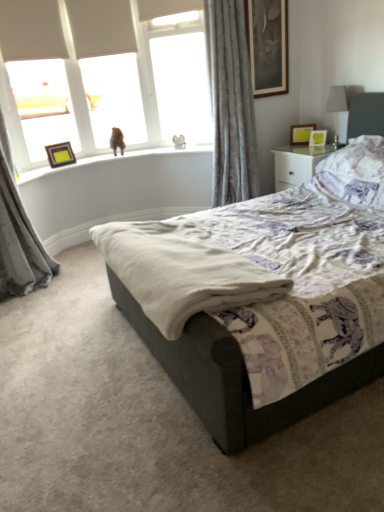
Locate an element on the screen. This screenshot has width=384, height=512. white glossy nightstand at upper right is located at coordinates [x=298, y=163].

Describe the element at coordinates (43, 105) in the screenshot. I see `matte white frame at upper left` at that location.

Locate an element on the screen. The image size is (384, 512). matte yellow picture frame at upper right, marked as the first picture frame in a right-to-left arrangement is located at coordinates (318, 138).

Describe the element at coordinates (318, 138) in the screenshot. I see `matte yellow picture frame at upper right, marked as the first picture frame in a right-to-left arrangement` at that location.

Locate an element on the screen. white glossy nightstand at upper right is located at coordinates (298, 163).

Is matte black picture frame at upper left, the 4th picture frame in the right-to-left sequence, thinner than matte yellow picture frame at upper right, marked as the first picture frame in a right-to-left arrangement?

Incorrect, the width of matte black picture frame at upper left, the 4th picture frame in the right-to-left sequence, is not less than that of matte yellow picture frame at upper right, marked as the first picture frame in a right-to-left arrangement.

From the image's perspective, which one is positioned lower, matte black picture frame at upper left, placed as the 4th picture frame when sorted from top to bottom, or matte yellow picture frame at upper right, the 4th picture frame from the left?

From the image's view, matte black picture frame at upper left, placed as the 4th picture frame when sorted from top to bottom, is below.

Based on the photo, which is farther from the camera, [49,158] or [312,145]?

The point [49,158] is farther from the camera.

In the scene shown: Which object is further away from the camera, gray velvet curtain at upper right, arranged as the 1th curtain when viewed from the right, or matte black picture frame at upper left, the 4th picture frame in the right-to-left sequence?

matte black picture frame at upper left, the 4th picture frame in the right-to-left sequence, is more distant.

Does gray velvet curtain at upper right, which ranks as the second curtain in left-to-right order, contain matte black picture frame at upper left, the 4th picture frame in the right-to-left sequence?

No, matte black picture frame at upper left, the 4th picture frame in the right-to-left sequence, is not surrounded by gray velvet curtain at upper right, which ranks as the second curtain in left-to-right order.

Between gray velvet curtain at upper right, which ranks as the second curtain in left-to-right order, and matte black picture frame at upper left, placed as the 4th picture frame when sorted from top to bottom, which one has more height?

With more height is gray velvet curtain at upper right, which ranks as the second curtain in left-to-right order.

Considering the relative sizes of gray velvet curtain at upper right, arranged as the 1th curtain when viewed from the right, and matte black picture frame at upper left, the 4th picture frame in the right-to-left sequence, in the image provided, is gray velvet curtain at upper right, arranged as the 1th curtain when viewed from the right, thinner than matte black picture frame at upper left, the 4th picture frame in the right-to-left sequence,?

Incorrect, the width of gray velvet curtain at upper right, arranged as the 1th curtain when viewed from the right, is not less than that of matte black picture frame at upper left, the 4th picture frame in the right-to-left sequence.

From the image's perspective, would you say wooden-framed picture at upper right, which is the second picture frame from left to right, is shown under white plastic window screen at upper center?

Actually, wooden-framed picture at upper right, which is the second picture frame from left to right, appears above white plastic window screen at upper center in the image.

At what (x,y) coordinates should I click in order to perform the action: click on picture frame in front of the white plastic window screen at upper center. Please return your answer as a coordinate pair (x, y). The width and height of the screenshot is (384, 512). Looking at the image, I should click on (267, 45).

Does wooden-framed picture at upper right, which is the second picture frame from left to right, come in front of white plastic window screen at upper center?

Yes, it is.

In terms of height, does wooden-framed picture at upper right, which is the second picture frame from left to right, look taller or shorter compared to white plastic window screen at upper center?

In the image, wooden-framed picture at upper right, which is the second picture frame from left to right, appears to be shorter than white plastic window screen at upper center.

How distant is matte yellow picture frame at upper right, arranged as the third picture frame when viewed from the left, from beige cotton blanket at center?

matte yellow picture frame at upper right, arranged as the third picture frame when viewed from the left, and beige cotton blanket at center are 2.08 meters apart from each other.

Is matte yellow picture frame at upper right, positioned as the 2th picture frame in top-to-bottom order, facing away from beige cotton blanket at center?

No, matte yellow picture frame at upper right, positioned as the 2th picture frame in top-to-bottom order,'s orientation is not away from beige cotton blanket at center.

Would you consider matte yellow picture frame at upper right, the third picture frame in the bottom-to-top sequence, to be distant from beige cotton blanket at center?

Yes, matte yellow picture frame at upper right, the third picture frame in the bottom-to-top sequence, and beige cotton blanket at center are located far from each other.

Between matte yellow picture frame at upper right, arranged as the third picture frame when viewed from the left, and beige cotton blanket at center, which one has larger width?

beige cotton blanket at center.

Which is more to the right, wooden-framed picture at upper right, which is the second picture frame from left to right, or beige cotton blanket at center?

wooden-framed picture at upper right, which is the second picture frame from left to right.

Can you confirm if wooden-framed picture at upper right, marked as the 4th picture frame in a bottom-to-top arrangement, is smaller than beige cotton blanket at center?

Indeed, wooden-framed picture at upper right, marked as the 4th picture frame in a bottom-to-top arrangement, has a smaller size compared to beige cotton blanket at center.

From the image's perspective, is wooden-framed picture at upper right, positioned as the 1th picture frame in top-to-bottom order, located above or below beige cotton blanket at center?

From the image's perspective, wooden-framed picture at upper right, positioned as the 1th picture frame in top-to-bottom order, appears above beige cotton blanket at center.

Based on the photo, from a real-world perspective, which is physically below, wooden-framed picture at upper right, marked as the 4th picture frame in a bottom-to-top arrangement, or beige cotton blanket at center?

In real-world perspective, beige cotton blanket at center is lower.

In the scene shown: Is matte yellow picture frame at upper right, marked as the first picture frame in a right-to-left arrangement, located outside wooden-framed picture at upper right, marked as the 4th picture frame in a bottom-to-top arrangement?

That's correct, matte yellow picture frame at upper right, marked as the first picture frame in a right-to-left arrangement, is outside of wooden-framed picture at upper right, marked as the 4th picture frame in a bottom-to-top arrangement.

Is matte yellow picture frame at upper right, marked as the first picture frame in a right-to-left arrangement, bigger or smaller than wooden-framed picture at upper right, positioned as the 1th picture frame in top-to-bottom order?

Clearly, matte yellow picture frame at upper right, marked as the first picture frame in a right-to-left arrangement, is smaller in size than wooden-framed picture at upper right, positioned as the 1th picture frame in top-to-bottom order.

Is the surface of matte yellow picture frame at upper right, arranged as the second picture frame when ordered from the bottom, in direct contact with wooden-framed picture at upper right, positioned as the 1th picture frame in top-to-bottom order?

No, matte yellow picture frame at upper right, arranged as the second picture frame when ordered from the bottom, is not beside wooden-framed picture at upper right, positioned as the 1th picture frame in top-to-bottom order.

From the image's perspective, is velvet gray curtain at left, the 2th curtain from the right, over velvet grey bed at center?

Yes.

Would you say velvet grey bed at center is part of velvet gray curtain at left, the 2th curtain from the right,'s contents?

No, velvet grey bed at center is not inside velvet gray curtain at left, the 2th curtain from the right.

From a real-world perspective, relative to velvet grey bed at center, is velvet gray curtain at left, the 2th curtain from the right, vertically above or below?

velvet gray curtain at left, the 2th curtain from the right, is situated higher than velvet grey bed at center in the real world.

Who is more distant, velvet gray curtain at left, the 2th curtain from the right, or velvet grey bed at center?

velvet gray curtain at left, the 2th curtain from the right, is more distant.

Locate an element on the screen. This screenshot has height=512, width=384. the 1st picture frame behind the matte yellow picture frame at upper right, arranged as the second picture frame when ordered from the bottom, counting from the anchor's position is located at coordinates (60, 154).

You are a GUI agent. You are given a task and a screenshot of the screen. Output one action in this format:
    pyautogui.click(x=<x>, y=<y>)
    Task: Click on the 1st picture frame positioned below the gray velvet curtain at upper right, which ranks as the second curtain in left-to-right order (from a real-world perspective)
    The height and width of the screenshot is (512, 384).
    Given the screenshot: What is the action you would take?
    pyautogui.click(x=60, y=154)

From the image, which object appears to be farther from gray velvet curtain at upper right, which ranks as the second curtain in left-to-right order, matte black picture frame at upper left, the first picture frame in the left-to-right sequence, or matte yellow picture frame at upper right, which ranks as the second picture frame in right-to-left order?

matte black picture frame at upper left, the first picture frame in the left-to-right sequence, is positioned further to the anchor gray velvet curtain at upper right, which ranks as the second curtain in left-to-right order.

Which object lies nearer to the anchor point velvet gray curtain at left, which ranks as the 1th curtain in left-to-right order, matte white frame at upper left or beige cotton blanket at center?

Based on the image, beige cotton blanket at center appears to be nearer to velvet gray curtain at left, which ranks as the 1th curtain in left-to-right order.

When comparing their distances from matte yellow picture frame at upper right, the 4th picture frame from the left, does white glossy nightstand at upper right or wooden-framed picture at upper right, positioned as the 1th picture frame in top-to-bottom order, seem closer?

white glossy nightstand at upper right is positioned closer to the anchor matte yellow picture frame at upper right, the 4th picture frame from the left.

Considering their positions, is matte yellow picture frame at upper right, the 4th picture frame from the left, positioned closer to purple floral pillow at upper right than gray velvet curtain at upper right, arranged as the 1th curtain when viewed from the right?

matte yellow picture frame at upper right, the 4th picture frame from the left, is closer to purple floral pillow at upper right.

When comparing their distances from velvet grey bed at center, does wooden-framed picture at upper right, marked as the 4th picture frame in a bottom-to-top arrangement, or matte white frame at upper left seem further?

Among the two, matte white frame at upper left is located further to velvet grey bed at center.

Looking at the image, which one is located closer to matte white frame at upper left, matte black picture frame at upper left, the first picture frame in the left-to-right sequence, or velvet gray curtain at left, which ranks as the 1th curtain in left-to-right order?

Based on the image, matte black picture frame at upper left, the first picture frame in the left-to-right sequence, appears to be nearer to matte white frame at upper left.

Consider the image. Considering their positions, is matte white frame at upper left positioned closer to matte black picture frame at upper left, which is the 1th picture frame from bottom to top, than matte yellow picture frame at upper right, the third picture frame viewed from the top?

Based on the image, matte yellow picture frame at upper right, the third picture frame viewed from the top, appears to be nearer to matte black picture frame at upper left, which is the 1th picture frame from bottom to top.

Looking at the image, which one is located further to purple floral pillow at upper right, white plastic window screen at upper center or beige cotton blanket at center?

white plastic window screen at upper center lies further to purple floral pillow at upper right than the other object.

Locate an element on the screen. This screenshot has width=384, height=512. cloth positioned between velvet grey bed at center and wooden-framed picture at upper right, positioned as the 1th picture frame in top-to-bottom order, from near to far is located at coordinates (183, 270).

Find the location of a particular element. The image size is (384, 512). window screen between velvet grey bed at center and matte yellow picture frame at upper right, which ranks as the second picture frame in right-to-left order, in the front-back direction is located at coordinates (178, 78).

The width and height of the screenshot is (384, 512). Identify the location of cloth between velvet gray curtain at left, the 2th curtain from the right, and matte yellow picture frame at upper right, marked as the first picture frame in a right-to-left arrangement, from left to right. (183, 270).

Image resolution: width=384 pixels, height=512 pixels. I want to click on cloth located between velvet grey bed at center and gray velvet curtain at upper right, arranged as the 1th curtain when viewed from the right, in the depth direction, so click(183, 270).